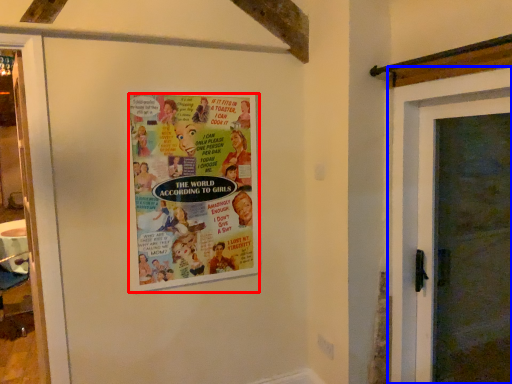
Question: Which object is closer to the camera taking this photo, poster (highlighted by a red box) or door (highlighted by a blue box)?

Choices:
 (A) poster
 (B) door

Answer: (B)